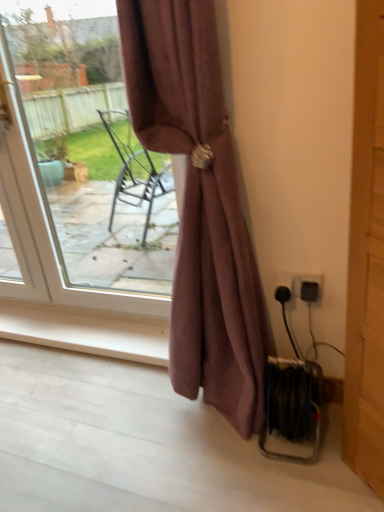
This screenshot has height=512, width=384. Identify the location of wooden door at right. (366, 258).

Measure the distance between point (361, 392) and camera.

Point (361, 392) is 1.11 meters away from camera.

Image resolution: width=384 pixels, height=512 pixels. Find the location of `mauve fabric curtain at center`. mauve fabric curtain at center is located at coordinates (200, 206).

The height and width of the screenshot is (512, 384). What do you see at coordinates (284, 287) in the screenshot? I see `black plastic socket at lower right, placed as the 2th electric outlet when sorted from right to left` at bounding box center [284, 287].

What is the approximate width of black plastic electric outlet at lower right, acting as the first electric outlet starting from the right?

It is 2.31 inches.

Locate an element on the screen. This screenshot has width=384, height=512. wooden door at right is located at coordinates (366, 258).

Who is shorter, mauve fabric curtain at center or matte white door at upper left?

With less height is mauve fabric curtain at center.

Is mauve fabric curtain at center completely or partially outside of matte white door at upper left?

mauve fabric curtain at center is positioned outside matte white door at upper left.

Who is more distant, mauve fabric curtain at center or matte white door at upper left?

matte white door at upper left.

Which of these two, mauve fabric curtain at center or matte white door at upper left, is bigger?

Bigger between the two is mauve fabric curtain at center.

From the image's perspective, which one is positioned higher, black plastic socket at lower right, placed as the 2th electric outlet when sorted from right to left, or wooden door at right?

wooden door at right, from the image's perspective.

Which is nearer, (289,284) or (354,399)?

The point (354,399) is closer.

Could you tell me if black plastic socket at lower right, placed as the 2th electric outlet when sorted from right to left, is turned towards wooden door at right?

No, black plastic socket at lower right, placed as the 2th electric outlet when sorted from right to left, is not oriented towards wooden door at right.

From a real-world perspective, is black plastic socket at lower right, the first electric outlet when ordered from left to right, under wooden door at right?

Yes.

Does point (300, 278) appear closer or farther from the camera than point (137, 99)?

Point (300, 278) is farther from the camera than point (137, 99).

Does black plastic electric outlet at lower right, which is counted as the second electric outlet, starting from the left, have a greater height compared to mauve fabric curtain at center?

In fact, black plastic electric outlet at lower right, which is counted as the second electric outlet, starting from the left, may be shorter than mauve fabric curtain at center.

Would you say black plastic electric outlet at lower right, which is counted as the second electric outlet, starting from the left, is to the left or to the right of mauve fabric curtain at center in the picture?

Clearly, black plastic electric outlet at lower right, which is counted as the second electric outlet, starting from the left, is on the right of mauve fabric curtain at center in the image.

Considering the positions of objects black plastic electric outlet at lower right, which is counted as the second electric outlet, starting from the left, and mauve fabric curtain at center in the image provided, who is in front, black plastic electric outlet at lower right, which is counted as the second electric outlet, starting from the left, or mauve fabric curtain at center?

Positioned in front is mauve fabric curtain at center.

Between black plastic socket at lower right, placed as the 2th electric outlet when sorted from right to left, and black plastic electric outlet at lower right, which is counted as the second electric outlet, starting from the left, which one has smaller width?

black plastic electric outlet at lower right, which is counted as the second electric outlet, starting from the left, is thinner.

This screenshot has height=512, width=384. I want to click on electric outlet located behind the black plastic electric outlet at lower right, acting as the first electric outlet starting from the right, so click(284, 287).

Is black plastic socket at lower right, the first electric outlet when ordered from left to right, located outside black plastic electric outlet at lower right, which is counted as the second electric outlet, starting from the left?

Yes.

Considering the positions of objects black plastic socket at lower right, placed as the 2th electric outlet when sorted from right to left, and black plastic electric outlet at lower right, which is counted as the second electric outlet, starting from the left, in the image provided, who is more to the right, black plastic socket at lower right, placed as the 2th electric outlet when sorted from right to left, or black plastic electric outlet at lower right, which is counted as the second electric outlet, starting from the left,?

Positioned to the right is black plastic electric outlet at lower right, which is counted as the second electric outlet, starting from the left.

From a real-world perspective, which is physically below, black plastic socket at lower right, placed as the 2th electric outlet when sorted from right to left, or matte white door at upper left?

black plastic socket at lower right, placed as the 2th electric outlet when sorted from right to left, from a real-world perspective.

Is black plastic socket at lower right, placed as the 2th electric outlet when sorted from right to left, aimed at matte white door at upper left?

No, black plastic socket at lower right, placed as the 2th electric outlet when sorted from right to left, is not turned towards matte white door at upper left.

Considering the relative sizes of black plastic socket at lower right, the first electric outlet when ordered from left to right, and matte white door at upper left in the image provided, is black plastic socket at lower right, the first electric outlet when ordered from left to right, taller than matte white door at upper left?

Incorrect, the height of black plastic socket at lower right, the first electric outlet when ordered from left to right, is not larger of that of matte white door at upper left.

Considering the relative positions of black plastic socket at lower right, the first electric outlet when ordered from left to right, and matte white door at upper left in the image provided, is black plastic socket at lower right, the first electric outlet when ordered from left to right, to the left or to the right of matte white door at upper left?

Based on their positions, black plastic socket at lower right, the first electric outlet when ordered from left to right, is located to the right of matte white door at upper left.

Consider the image. Are wooden door at right and black plastic electric outlet at lower right, acting as the first electric outlet starting from the right, beside each other?

No, wooden door at right is not with black plastic electric outlet at lower right, acting as the first electric outlet starting from the right.

Which of these two, wooden door at right or black plastic electric outlet at lower right, which is counted as the second electric outlet, starting from the left, stands taller?

With more height is wooden door at right.

Considering the positions of objects wooden door at right and black plastic electric outlet at lower right, acting as the first electric outlet starting from the right, in the image provided, who is behind, wooden door at right or black plastic electric outlet at lower right, acting as the first electric outlet starting from the right,?

black plastic electric outlet at lower right, acting as the first electric outlet starting from the right.

From the image's perspective, between wooden door at right and black plastic electric outlet at lower right, which is counted as the second electric outlet, starting from the left, who is located below?

black plastic electric outlet at lower right, which is counted as the second electric outlet, starting from the left.

Can you confirm if matte white door at upper left is taller than wooden door at right?

Yes.

Is matte white door at upper left positioned with its back to wooden door at right?

No, matte white door at upper left is not facing away from wooden door at right.

Is matte white door at upper left touching wooden door at right?

No, matte white door at upper left is not with wooden door at right.

Which point is more forward, (55, 145) or (377, 370)?

Positioned in front is point (377, 370).

Identify the location of door above the mauve fabric curtain at center (from the image's perspective). [x=93, y=176].

Identify the location of screen door above the black plastic socket at lower right, placed as the 2th electric outlet when sorted from right to left (from a real-world perspective). This screenshot has width=384, height=512. (366, 258).

Based on their spatial positions, is black plastic electric outlet at lower right, which is counted as the second electric outlet, starting from the left, or black plastic socket at lower right, placed as the 2th electric outlet when sorted from right to left, further from wooden door at right?

black plastic socket at lower right, placed as the 2th electric outlet when sorted from right to left, lies further to wooden door at right than the other object.

Which object lies nearer to the anchor point mauve fabric curtain at center, matte white door at upper left or wooden door at right?

The object closer to mauve fabric curtain at center is wooden door at right.

Looking at the image, which one is located further to wooden door at right, black plastic socket at lower right, the first electric outlet when ordered from left to right, or matte white door at upper left?

matte white door at upper left is positioned further to the anchor wooden door at right.

Looking at the image, which one is located closer to wooden door at right, matte white door at upper left or mauve fabric curtain at center?

mauve fabric curtain at center lies closer to wooden door at right than the other object.

Considering their positions, is black plastic socket at lower right, the first electric outlet when ordered from left to right, positioned closer to mauve fabric curtain at center than black plastic electric outlet at lower right, acting as the first electric outlet starting from the right?

Based on the image, black plastic socket at lower right, the first electric outlet when ordered from left to right, appears to be nearer to mauve fabric curtain at center.

Which object lies nearer to the anchor point matte white door at upper left, wooden door at right or black plastic electric outlet at lower right, acting as the first electric outlet starting from the right?

Based on the image, black plastic electric outlet at lower right, acting as the first electric outlet starting from the right, appears to be nearer to matte white door at upper left.

From the image, which object appears to be farther from matte white door at upper left, black plastic socket at lower right, the first electric outlet when ordered from left to right, or black plastic electric outlet at lower right, acting as the first electric outlet starting from the right?

black plastic electric outlet at lower right, acting as the first electric outlet starting from the right.

Looking at the image, which one is located closer to matte white door at upper left, black plastic electric outlet at lower right, which is counted as the second electric outlet, starting from the left, or black plastic socket at lower right, placed as the 2th electric outlet when sorted from right to left?

Among the two, black plastic socket at lower right, placed as the 2th electric outlet when sorted from right to left, is located nearer to matte white door at upper left.

This screenshot has width=384, height=512. Find the location of `electric outlet between wooden door at right and black plastic socket at lower right, placed as the 2th electric outlet when sorted from right to left, from front to back`. electric outlet between wooden door at right and black plastic socket at lower right, placed as the 2th electric outlet when sorted from right to left, from front to back is located at coordinates (308, 287).

This screenshot has height=512, width=384. Find the location of `electric outlet located between mauve fabric curtain at center and black plastic socket at lower right, placed as the 2th electric outlet when sorted from right to left, in the depth direction`. electric outlet located between mauve fabric curtain at center and black plastic socket at lower right, placed as the 2th electric outlet when sorted from right to left, in the depth direction is located at coordinates (308, 287).

Where is `curtain between matte white door at upper left and black plastic electric outlet at lower right, acting as the first electric outlet starting from the right, in the horizontal direction`? The height and width of the screenshot is (512, 384). curtain between matte white door at upper left and black plastic electric outlet at lower right, acting as the first electric outlet starting from the right, in the horizontal direction is located at coordinates (200, 206).

Find the location of a particular element. curtain situated between matte white door at upper left and wooden door at right from left to right is located at coordinates (200, 206).